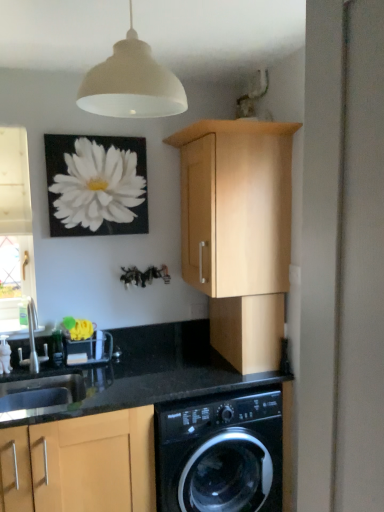
The height and width of the screenshot is (512, 384). What do you see at coordinates (220, 452) in the screenshot? I see `black glossy washing machine at lower center` at bounding box center [220, 452].

Identify the location of black granite sink at lower left. (41, 397).

Measure the distance between point (267, 305) and camera.

A distance of 6.54 feet exists between point (267, 305) and camera.

This screenshot has height=512, width=384. What do you see at coordinates (248, 331) in the screenshot? I see `matte wood cabinet at center, which is counted as the 2th cabinetry, starting from the top` at bounding box center [248, 331].

Where is `black glossy washing machine at lower center`? The width and height of the screenshot is (384, 512). black glossy washing machine at lower center is located at coordinates (220, 452).

Between matte wood cabinet at lower left, the 1th cabinetry from the bottom, and light wood cabinet at upper center, acting as the 3th cabinetry starting from the bottom, which one has less height?

light wood cabinet at upper center, acting as the 3th cabinetry starting from the bottom.

From the matte wood cabinet at lower left, arranged as the third cabinetry when viewed from the top, count 1st cabinetry to the right and point to it. Please provide its 2D coordinates.

[(238, 232)]

From the image's perspective, is matte wood cabinet at lower left, the 1th cabinetry from the bottom, on top of light wood cabinet at upper center, acting as the 3th cabinetry starting from the bottom?

Incorrect, from the image's perspective, matte wood cabinet at lower left, the 1th cabinetry from the bottom, is lower than light wood cabinet at upper center, acting as the 3th cabinetry starting from the bottom.

Who is shorter, silver metallic faucet at lower left or black glossy washing machine at lower center?

Standing shorter between the two is silver metallic faucet at lower left.

How different are the orientations of silver metallic faucet at lower left and black glossy washing machine at lower center in degrees?

The angular difference between silver metallic faucet at lower left and black glossy washing machine at lower center is 0.737 degrees.

Is silver metallic faucet at lower left located outside black glossy washing machine at lower center?

Indeed, silver metallic faucet at lower left is completely outside black glossy washing machine at lower center.

Which is more to the right, silver metallic faucet at lower left or black glossy washing machine at lower center?

Positioned to the right is black glossy washing machine at lower center.

Consider the image. Which of these two, black glossy washing machine at lower center or clear glass window at left, is smaller?

clear glass window at left.

Is point (198, 398) positioned behind point (36, 298)?

No, it is not.

Which of these two, black glossy washing machine at lower center or clear glass window at left, stands shorter?

black glossy washing machine at lower center.

From the image's perspective, would you say black glossy washing machine at lower center is shown under clear glass window at left?

Yes, from the image's perspective, black glossy washing machine at lower center is beneath clear glass window at left.

Considering the sizes of objects matte wood cabinet at center, which is the second cabinetry from bottom to top, and white matte flower at upper left in the image provided, who is smaller, matte wood cabinet at center, which is the second cabinetry from bottom to top, or white matte flower at upper left?

With smaller size is white matte flower at upper left.

Are matte wood cabinet at center, which is counted as the 2th cabinetry, starting from the top, and white matte flower at upper left making contact?

No, matte wood cabinet at center, which is counted as the 2th cabinetry, starting from the top, is not in contact with white matte flower at upper left.

Identify the location of flower located above the matte wood cabinet at center, which is counted as the 2th cabinetry, starting from the top (from the image's perspective). (96, 185).

Can you tell me how much matte wood cabinet at center, which is counted as the 2th cabinetry, starting from the top, and white matte flower at upper left differ in facing direction?

matte wood cabinet at center, which is counted as the 2th cabinetry, starting from the top, and white matte flower at upper left are facing 91.1 degrees away from each other.

Does white matte lampshade at upper center have a larger size compared to matte wood cabinet at center, which is counted as the 2th cabinetry, starting from the top?

Actually, white matte lampshade at upper center might be smaller than matte wood cabinet at center, which is counted as the 2th cabinetry, starting from the top.

Which is behind, white matte lampshade at upper center or matte wood cabinet at center, which is the second cabinetry from bottom to top?

matte wood cabinet at center, which is the second cabinetry from bottom to top.

How different are the orientations of light wood cabinet at upper center, acting as the 3th cabinetry starting from the bottom, and white matte flower at upper left in degrees?

The angular difference between light wood cabinet at upper center, acting as the 3th cabinetry starting from the bottom, and white matte flower at upper left is 89.8 degrees.

Is light wood cabinet at upper center, acting as the 3th cabinetry starting from the bottom, facing towards white matte flower at upper left?

Yes, light wood cabinet at upper center, acting as the 3th cabinetry starting from the bottom, is oriented towards white matte flower at upper left.

Would you say light wood cabinet at upper center, acting as the 3th cabinetry starting from the bottom, contains white matte flower at upper left?

Definitely not — white matte flower at upper left is not inside light wood cabinet at upper center, acting as the 3th cabinetry starting from the bottom.

From a real-world perspective, who is located lower, light wood cabinet at upper center, acting as the 3th cabinetry starting from the bottom, or white matte flower at upper left?

light wood cabinet at upper center, acting as the 3th cabinetry starting from the bottom, from a real-world perspective.

In the scene shown: Which object is positioned more to the left, white matte flower at upper left or black granite sink at lower left?

From the viewer's perspective, black granite sink at lower left appears more on the left side.

Which is closer to the camera, (x=51, y=233) or (x=3, y=399)?

The point (x=3, y=399) is closer to the camera.

Would you consider white matte flower at upper left to be distant from black granite sink at lower left?

Actually, white matte flower at upper left and black granite sink at lower left are a little close together.

At what (x,y) coordinates should I click in order to perform the action: click on the 2nd cabinetry directly beneath the light wood cabinet at upper center, acting as the 3th cabinetry starting from the bottom (from a real-world perspective). Please return your answer as a coordinate pair (x, y). The width and height of the screenshot is (384, 512). Looking at the image, I should click on coord(81,464).

I want to click on faucet located behind the black glossy washing machine at lower center, so click(33, 342).

Considering their positions, is silver metallic faucet at lower left positioned further to light wood cabinet at upper center, which is counted as the first cabinetry, starting from the top, than white matte flower at upper left?

The object further to light wood cabinet at upper center, which is counted as the first cabinetry, starting from the top, is silver metallic faucet at lower left.

From the image, which object appears to be farther from white matte flower at upper left, black glossy washing machine at lower center or light wood cabinet at upper center, acting as the 3th cabinetry starting from the bottom?

The object further to white matte flower at upper left is black glossy washing machine at lower center.

Looking at the image, which one is located closer to light wood cabinet at upper center, which is counted as the first cabinetry, starting from the top, black granite sink at lower left or white matte lampshade at upper center?

Among the two, white matte lampshade at upper center is located nearer to light wood cabinet at upper center, which is counted as the first cabinetry, starting from the top.

Estimate the real-world distances between objects in this image. Which object is closer to matte wood cabinet at lower left, arranged as the third cabinetry when viewed from the top, white matte flower at upper left or silver metallic faucet at lower left?

silver metallic faucet at lower left is positioned closer to the anchor matte wood cabinet at lower left, arranged as the third cabinetry when viewed from the top.

Which object lies nearer to the anchor point white matte flower at upper left, matte wood cabinet at center, which is counted as the 2th cabinetry, starting from the top, or clear glass window at left?

The object closer to white matte flower at upper left is clear glass window at left.

Looking at the image, which one is located further to matte wood cabinet at lower left, arranged as the third cabinetry when viewed from the top, clear glass window at left or silver metallic faucet at lower left?

Based on the image, clear glass window at left appears to be further to matte wood cabinet at lower left, arranged as the third cabinetry when viewed from the top.

Looking at the image, which one is located further to light wood cabinet at upper center, acting as the 3th cabinetry starting from the bottom, clear glass window at left or black glossy washing machine at lower center?

Among the two, clear glass window at left is located further to light wood cabinet at upper center, acting as the 3th cabinetry starting from the bottom.

Considering their positions, is black glossy washing machine at lower center positioned further to matte wood cabinet at lower left, arranged as the third cabinetry when viewed from the top, than white matte lampshade at upper center?

white matte lampshade at upper center lies further to matte wood cabinet at lower left, arranged as the third cabinetry when viewed from the top, than the other object.

Locate an element on the screen. This screenshot has height=512, width=384. faucet positioned between white matte lampshade at upper center and white matte flower at upper left from near to far is located at coordinates (33, 342).

Locate an element on the screen. The image size is (384, 512). flower between white matte lampshade at upper center and black granite sink at lower left from top to bottom is located at coordinates (96, 185).

In order to click on washing machine between clear glass window at left and matte wood cabinet at lower left, arranged as the third cabinetry when viewed from the top, in the up-down direction in this screenshot , I will do `click(220, 452)`.

The height and width of the screenshot is (512, 384). I want to click on cabinetry between black granite sink at lower left and black glossy washing machine at lower center in the horizontal direction, so click(81, 464).